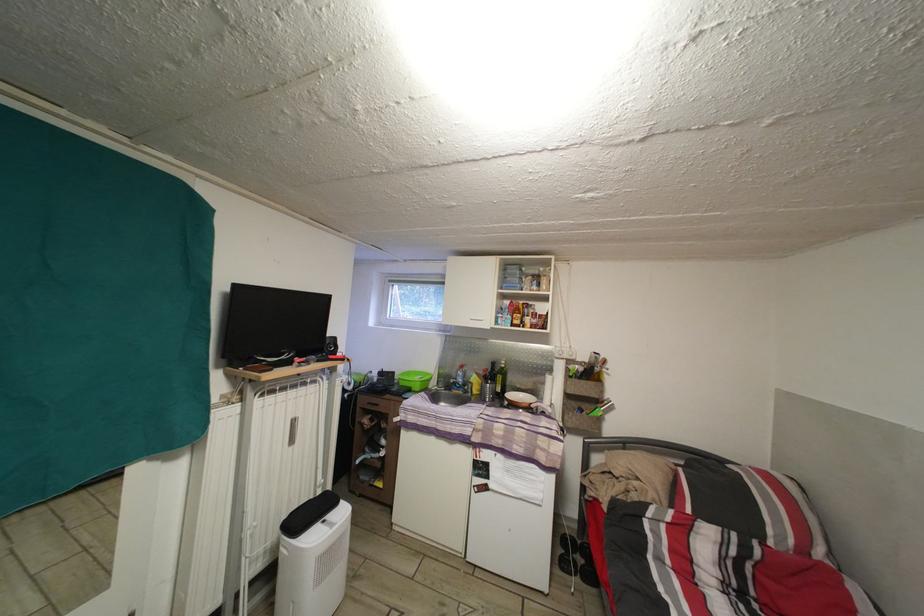
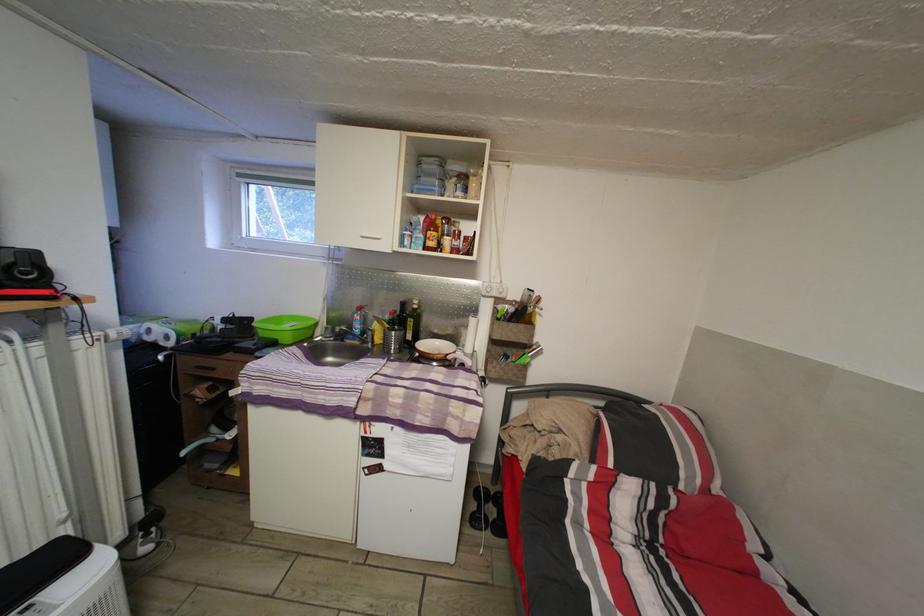
Locate, in the second image, the point that corresponds to point 399,379 in the first image.

(257, 326)